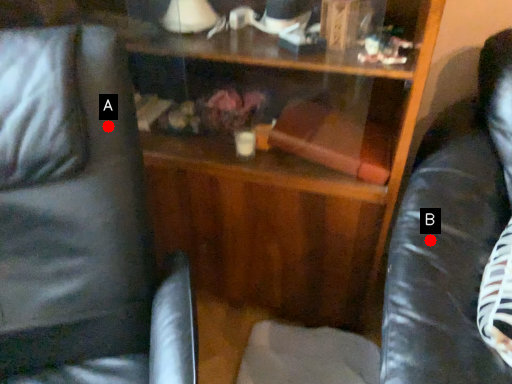
Question: Two points are circled on the image, labeled by A and B beside each circle. Which point appears closest to the camera in this image?

Choices:
 (A) A is closer
 (B) B is closer

Answer: (A)